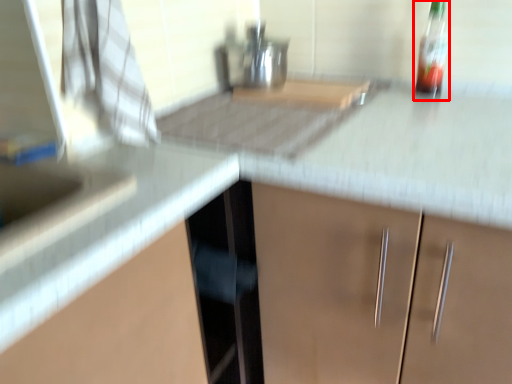
Question: From the image's perspective, where is bottle (annotated by the red box) located relative to counter top?

Choices:
 (A) below
 (B) above

Answer: (B)